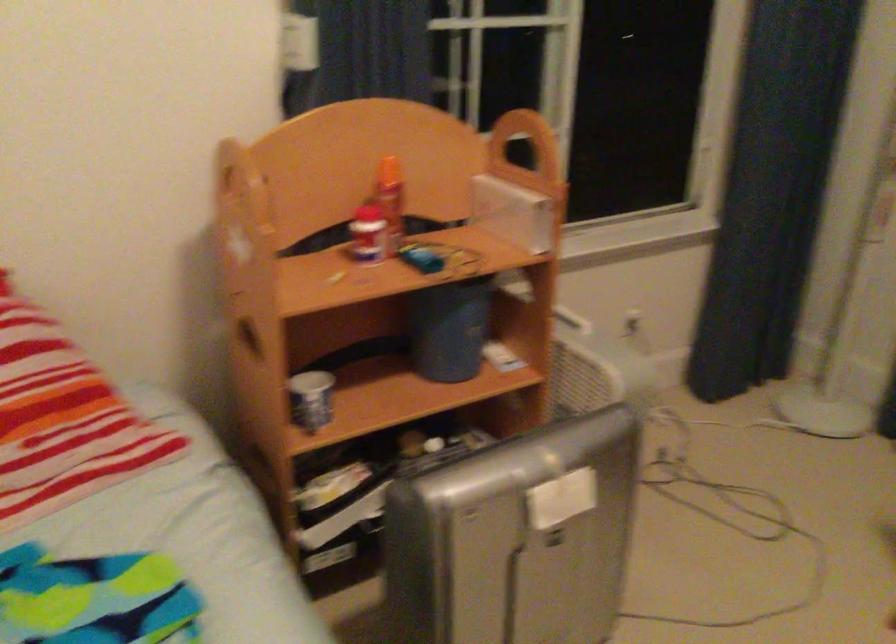
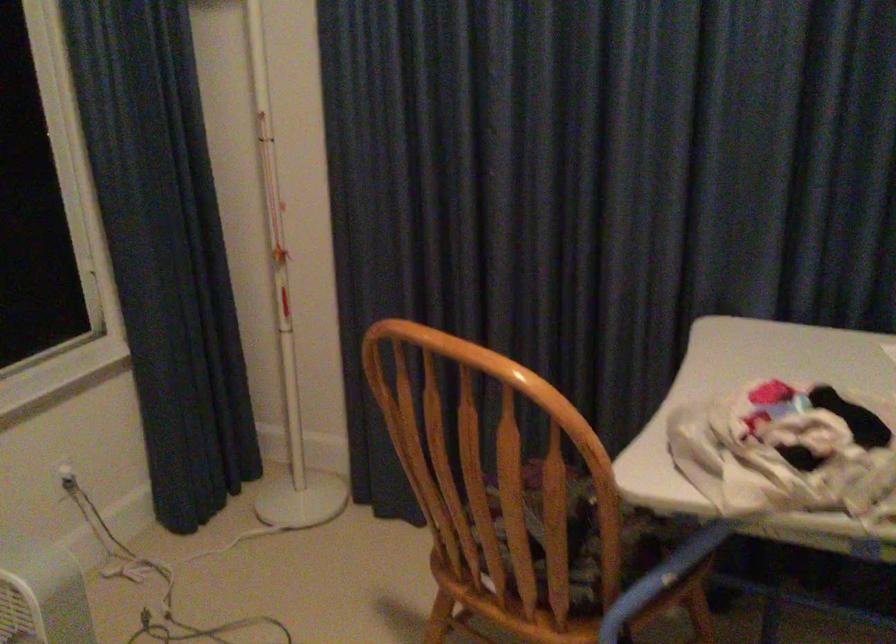
Where in the second image is the point corresponding to point (695, 98) from the first image?

(66, 230)